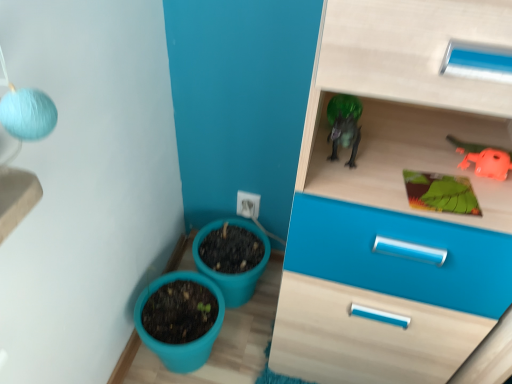
Question: Considering the positions of teal plastic flowerpot at lower left, marked as the 2th flowerpot in a back-to-front arrangement, and orange rubber toy at upper right in the image, is teal plastic flowerpot at lower left, marked as the 2th flowerpot in a back-to-front arrangement, taller or shorter than orange rubber toy at upper right?

Choices:
 (A) tall
 (B) short

Answer: (A)

Question: From a real-world perspective, is teal plastic flowerpot at lower left, marked as the 2th flowerpot in a back-to-front arrangement, positioned above or below orange rubber toy at upper right?

Choices:
 (A) below
 (B) above

Answer: (A)

Question: Estimate the real-world distances between objects in this image. Which object is farther from the teal plastic flowerpot at lower left, marked as the 2th flowerpot in a back-to-front arrangement?

Choices:
 (A) green matte board at upper right
 (B) matte plastic flowerpot at lower center, the second flowerpot in the front-to-back sequence
 (C) orange rubber toy at upper right

Answer: (C)

Question: Estimate the real-world distances between objects in this image. Which object is closer to the orange rubber toy at upper right?

Choices:
 (A) matte plastic flowerpot at lower center, the second flowerpot in the front-to-back sequence
 (B) teal plastic flowerpot at lower left, which is the first flowerpot in front-to-back order
 (C) green matte board at upper right

Answer: (C)